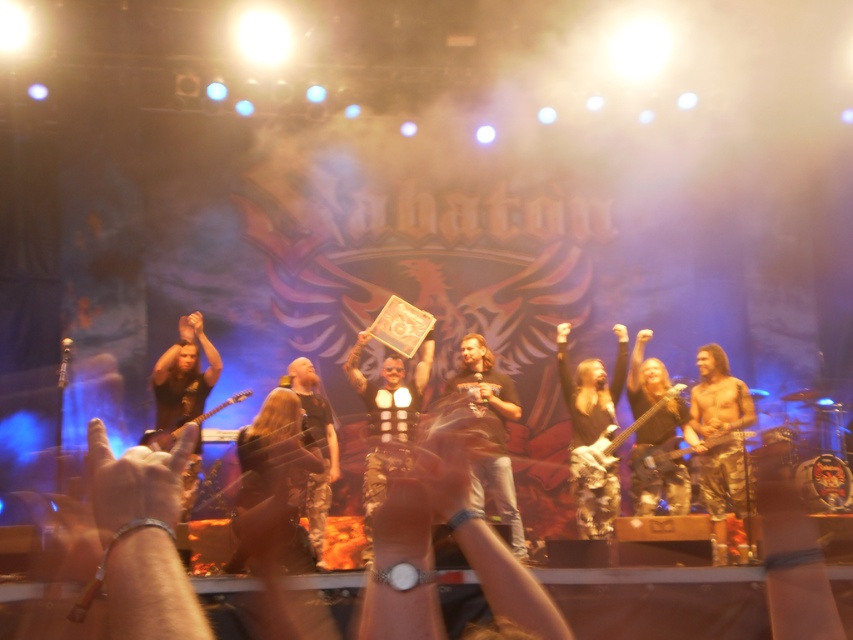
Does brown leather jacket at center have a greater height compared to camouflage-patterned guitar at center?

Correct, brown leather jacket at center is much taller as camouflage-patterned guitar at center.

Is brown leather jacket at center to the left of camouflage-patterned guitar at center from the viewer's perspective?

Correct, you'll find brown leather jacket at center to the left of camouflage-patterned guitar at center.

This screenshot has width=853, height=640. I want to click on brown leather jacket at center, so click(490, 432).

Find the location of `brown leather jacket at center`. brown leather jacket at center is located at coordinates (490, 432).

Between metallic bass guitar at center and camouflage-patterned guitar at center, which one is positioned lower?

camouflage-patterned guitar at center is lower down.

Identify the location of metallic bass guitar at center. This screenshot has height=640, width=853. (610, 444).

Locate an element on the screen. metallic bass guitar at center is located at coordinates (610, 444).

The height and width of the screenshot is (640, 853). In order to click on metallic bass guitar at center in this screenshot , I will do `click(610, 444)`.

Is point (477, 372) farther from viewer compared to point (627, 435)?

Yes, it is behind point (627, 435).

Between brown leather jacket at center and metallic bass guitar at center, which one appears on the right side from the viewer's perspective?

Positioned to the right is metallic bass guitar at center.

Who is more distant from viewer, (512, 548) or (636, 420)?

The point (636, 420) is more distant.

You are a GUI agent. You are given a task and a screenshot of the screen. Output one action in this format:
    pyautogui.click(x=<x>, y=<y>)
    Task: Click on the brown leather jacket at center
    The image size is (853, 640).
    Given the screenshot: What is the action you would take?
    pyautogui.click(x=490, y=432)